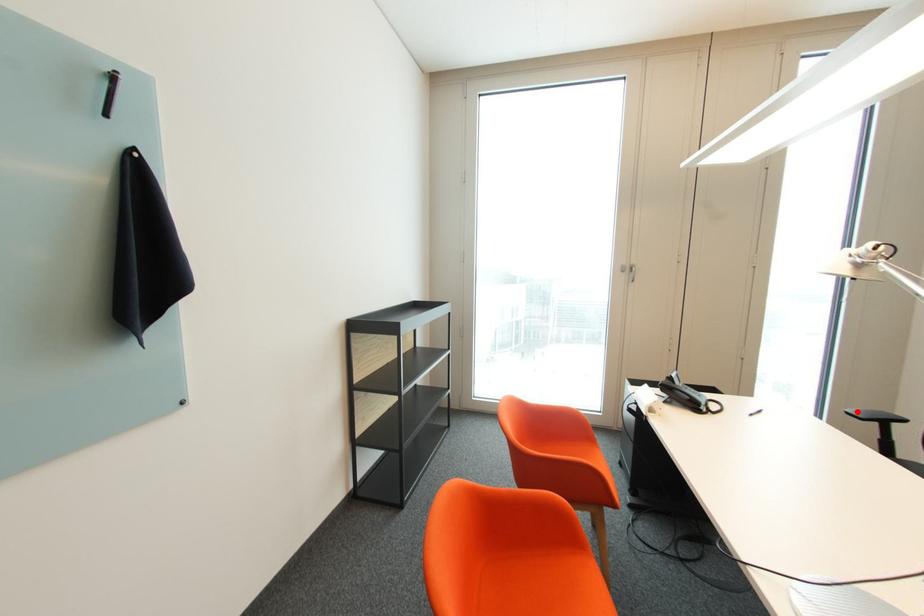
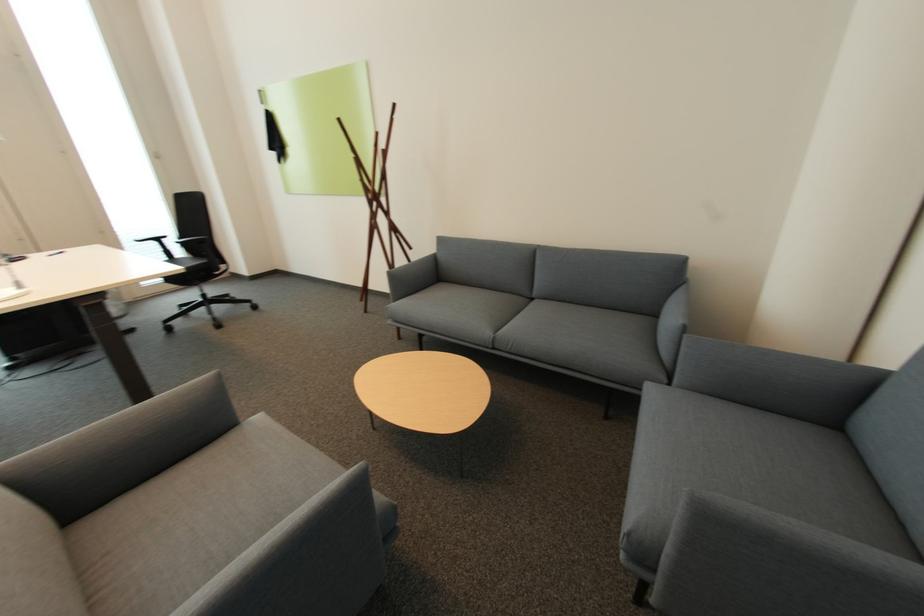
Question: I am providing you with two images of the same scene from different viewpoints. A red point is marked on the first image. Is the red point's position out of view in image 2?

Choices:
 (A) Yes
 (B) No

Answer: (B)